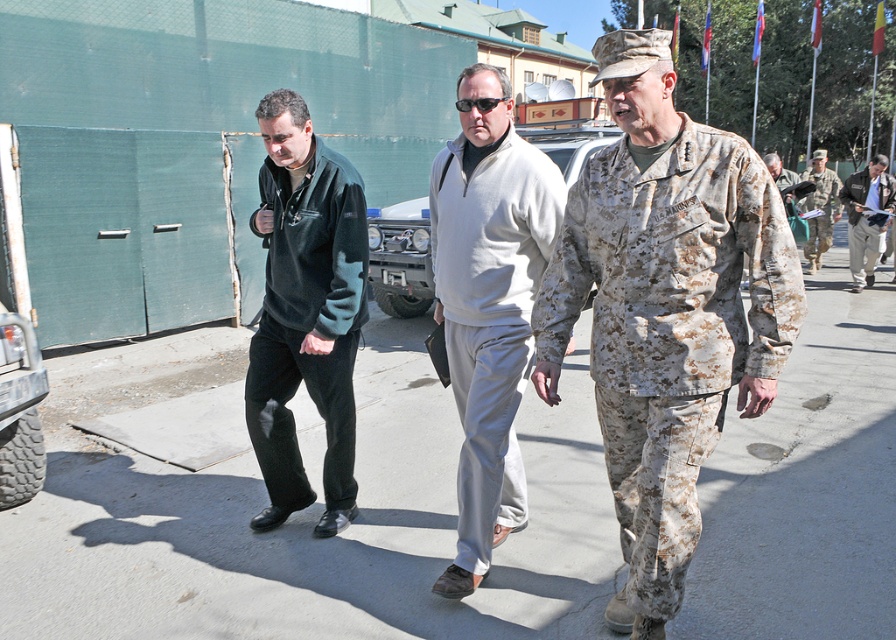
Does metallic silver jeep at center appear on the left side of camouflage uniform at right?

Correct, you'll find metallic silver jeep at center to the left of camouflage uniform at right.

Does point (378, 284) lie behind point (821, 221)?

No, it is not.

You are a GUI agent. You are given a task and a screenshot of the screen. Output one action in this format:
    pyautogui.click(x=<x>, y=<y>)
    Task: Click on the metallic silver jeep at center
    This screenshot has height=640, width=896.
    Given the screenshot: What is the action you would take?
    pyautogui.click(x=401, y=257)

Is gray concrete pavement at center positioned behind metallic silver jeep at center?

No, gray concrete pavement at center is in front of metallic silver jeep at center.

Is point (851, 486) closer to camera compared to point (567, 157)?

Yes.

Identify the location of gray concrete pavement at center. The height and width of the screenshot is (640, 896). (295, 513).

Which is in front, point (175, 428) or point (836, 198)?

Point (175, 428) is more forward.

Is point (450, 413) farther from viewer compared to point (816, 176)?

No, (450, 413) is closer to viewer.

This screenshot has width=896, height=640. Find the location of `gray concrete pavement at center`. gray concrete pavement at center is located at coordinates (295, 513).